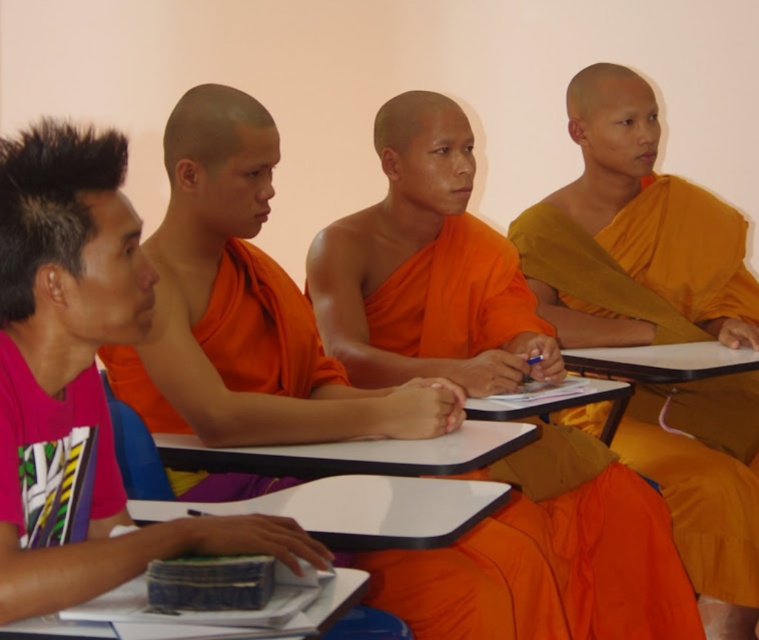
Who is more distant from viewer, [691,616] or [131,548]?

Positioned behind is point [691,616].

This screenshot has width=759, height=640. What do you see at coordinates (424, 268) in the screenshot?
I see `orange silk monk robe at center` at bounding box center [424, 268].

Locate an element on the screen. orange silk monk robe at center is located at coordinates (424, 268).

Is point (442, 412) positioned before point (695, 208)?

That is True.

Looking at this image, does orange silk robe at center lie behind orange cloth at center?

No, orange silk robe at center is closer to the viewer.

Is point (224, 116) less distant than point (583, 272)?

Yes.

Locate an element on the screen. Image resolution: width=759 pixels, height=640 pixels. orange silk robe at center is located at coordinates (244, 307).

Which is behind, point (748, 273) or point (74, 248)?

The point (748, 273) is behind.

Who is taller, orange cloth at center or pink fabric shirt at left?

orange cloth at center

Which is in front, point (663, 493) or point (90, 400)?

Point (90, 400)

Image resolution: width=759 pixels, height=640 pixels. What are the coordinates of `orange cloth at center` in the screenshot? It's located at (632, 234).